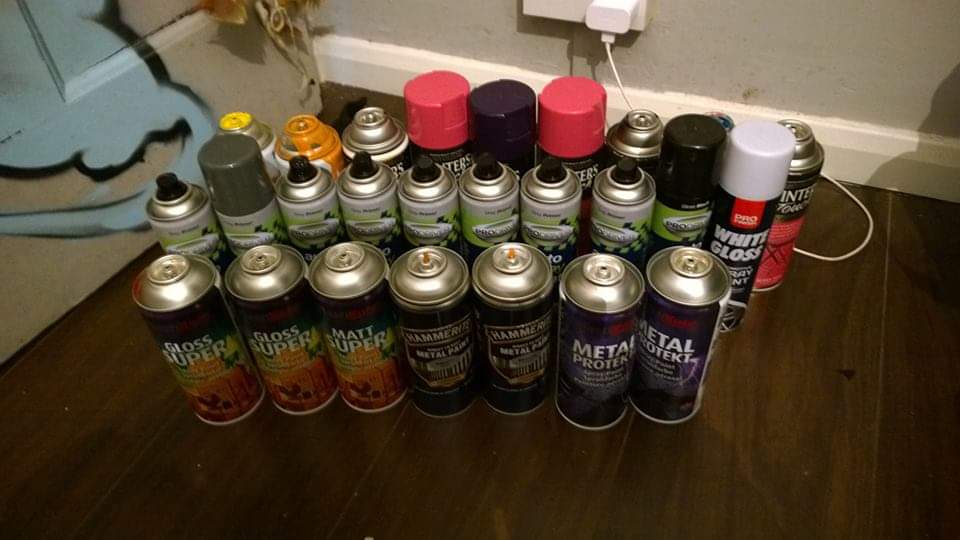
Find the location of a particular element. The width and height of the screenshot is (960, 540). plug is located at coordinates (607, 22).